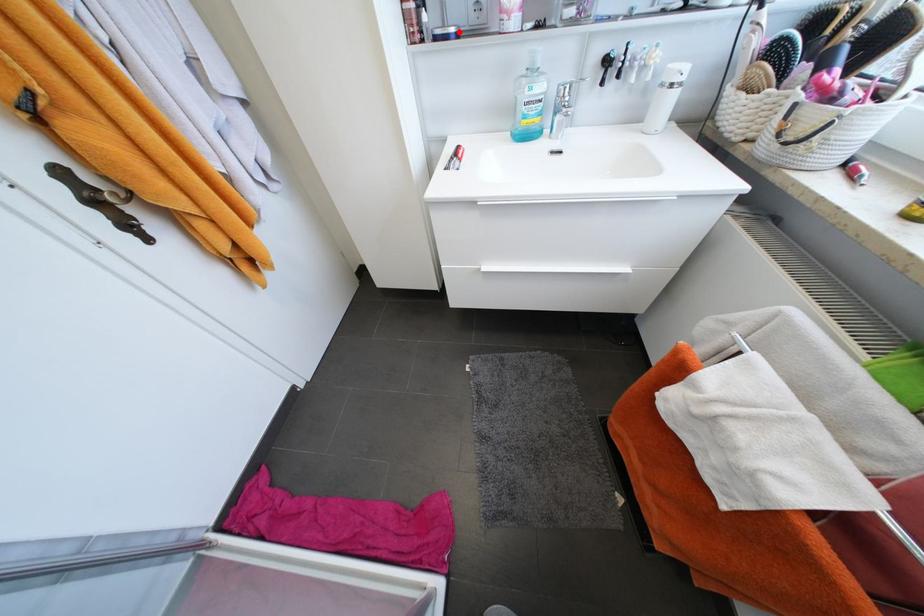
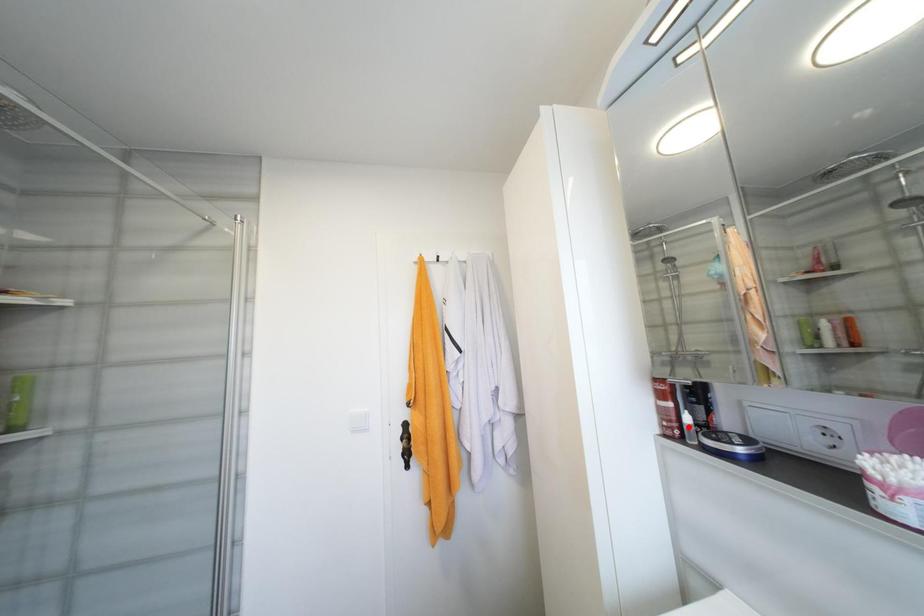
Looking at this image, I am providing you with two images of the same scene from different viewpoints. A red point is marked on the first image and another point is marked on the second image. Is the marked point in image1 the same physical position as the marked point in image2?

No